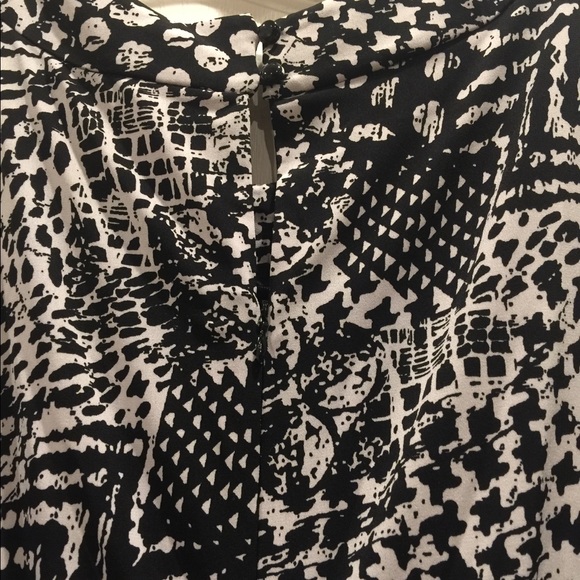
Locate an element on the screen. fabric button loops is located at coordinates (253, 32), (258, 79).